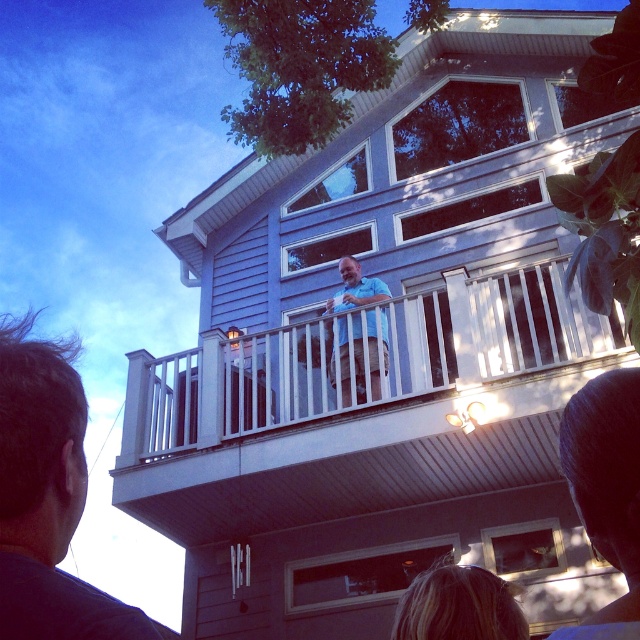
You are a photographer trying to capture a clear shot of both the dark brown hair at upper left and the light blue shirt at upper center. Based on their sizes in the image, which one would you focus on first to ensure both are in focus?

The dark brown hair at upper left is larger in size than the light blue shirt at upper center, so focusing on the dark brown hair at upper left first would help ensure both are in focus since it is closer to the camera.

Consider the image. You are standing in the scene and notice two items in the image. One is the blonde hair at lower center and the other is the light blue shirt at upper center. Which of these two items appears bigger in size?

The blonde hair at lower center appears bigger in size compared to the light blue shirt at upper center.